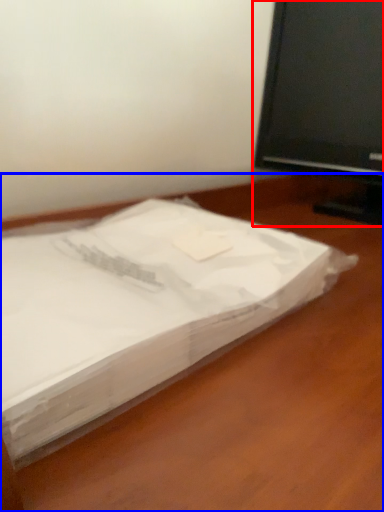
Question: Which point is further to the camera, television (highlighted by a red box) or desk (highlighted by a blue box)?

Choices:
 (A) television
 (B) desk

Answer: (A)